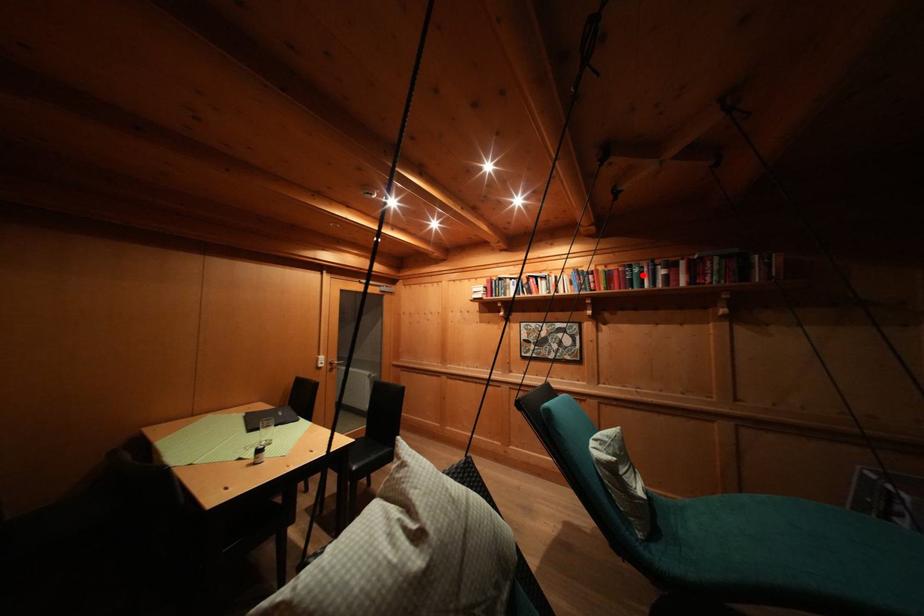
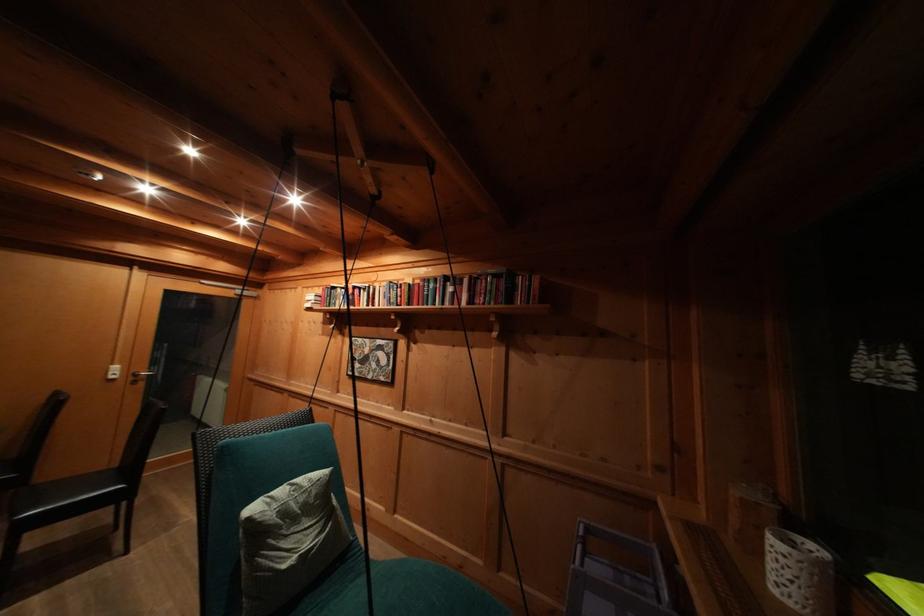
The point at the highlighted location is marked in the first image. Where is the corresponding point in the second image?

(438, 291)